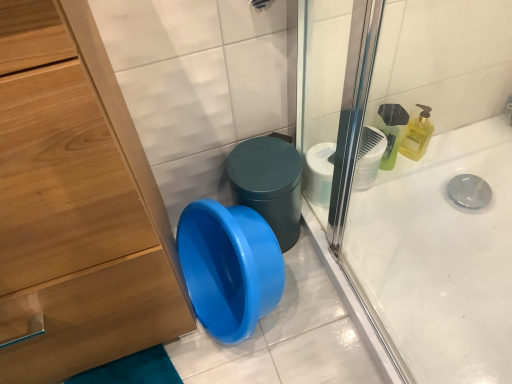
Image resolution: width=512 pixels, height=384 pixels. What are the coordinates of `wooden cabinet at left` in the screenshot? It's located at (75, 206).

The image size is (512, 384). Describe the element at coordinates (75, 206) in the screenshot. I see `wooden cabinet at left` at that location.

You are a GUI agent. You are given a task and a screenshot of the screen. Output one action in this format:
    pyautogui.click(x=<x>, y=<y>)
    Task: Click on the wooden cabinet at left
    The height and width of the screenshot is (384, 512).
    Given the screenshot: What is the action you would take?
    pyautogui.click(x=75, y=206)